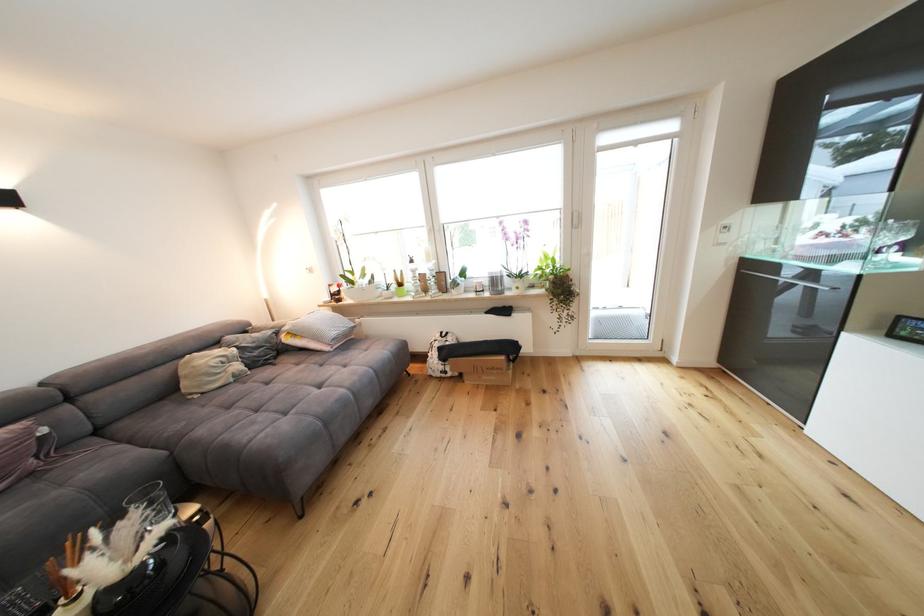
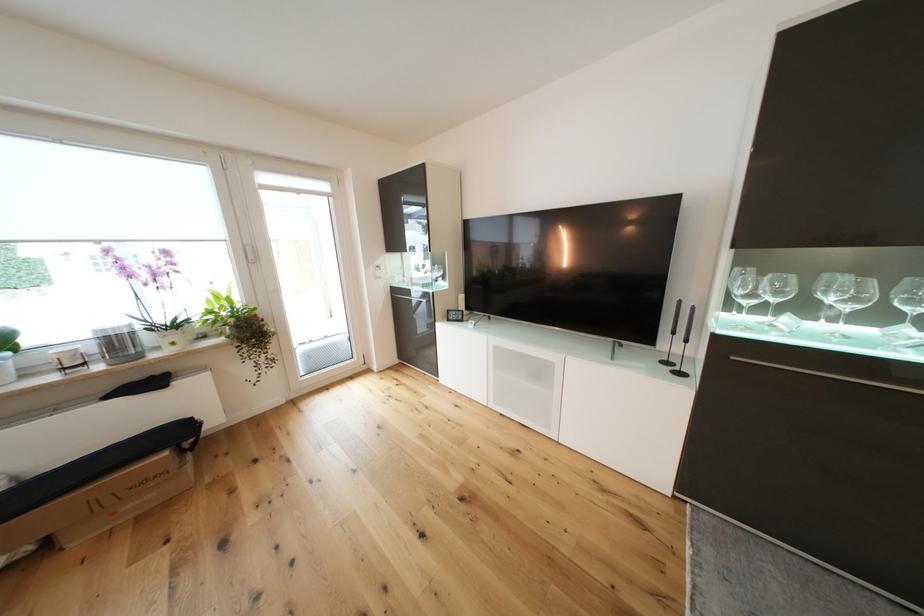
The point at (503, 284) is marked in the first image. Where is the corresponding point in the second image?

(124, 345)